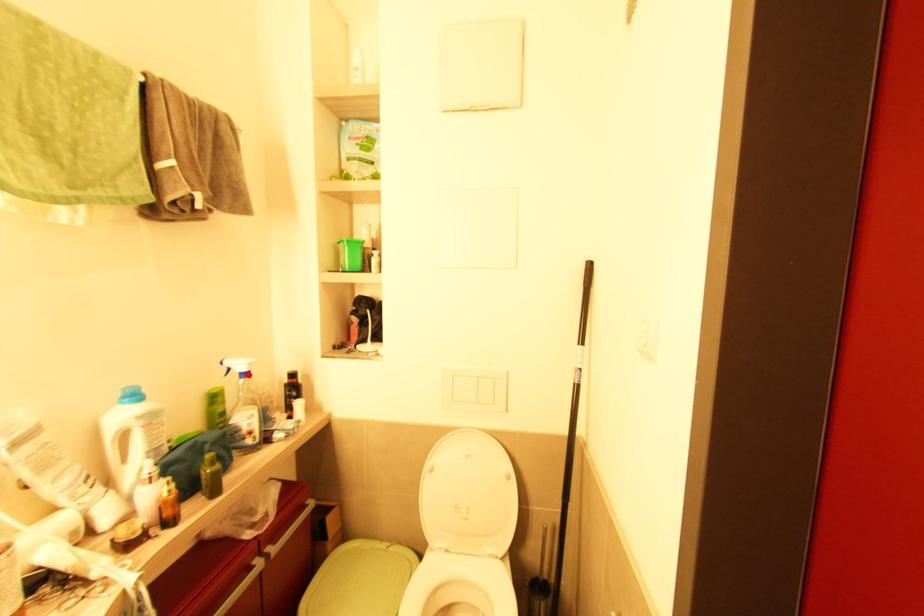
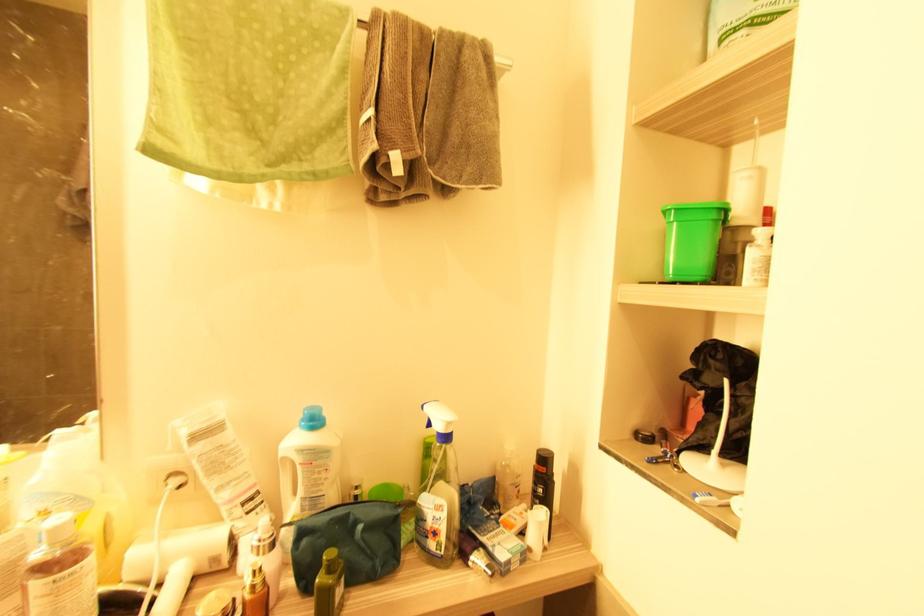
Find the pixel in the second image that matches the highlighted location in the first image.

(447, 438)